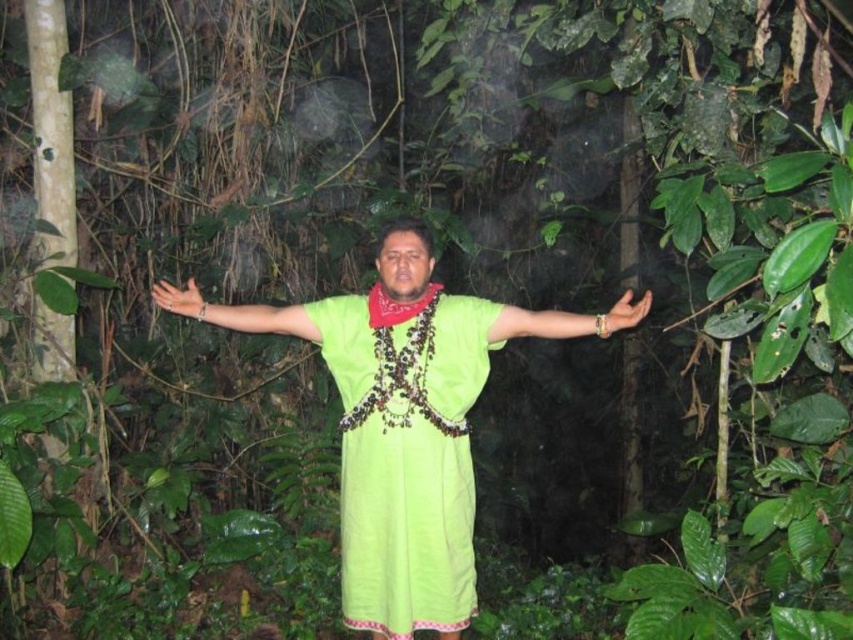
Question: Is lime green fabric at center wider than lime green fabric dress at center?

Choices:
 (A) yes
 (B) no

Answer: (A)

Question: Among these points, which one is farthest from the camera?

Choices:
 (A) (630, 307)
 (B) (581, 330)
 (C) (328, 362)
 (D) (177, 298)

Answer: (D)

Question: Which point is closer to the camera?

Choices:
 (A) (630, 320)
 (B) (376, 593)

Answer: (A)

Question: Is lime green fabric at center closer to camera compared to matte green hand at center?

Choices:
 (A) yes
 (B) no

Answer: (A)

Question: Which of the following is the farthest from the observer?

Choices:
 (A) (231, 310)
 (B) (364, 397)
 (C) (554, 324)

Answer: (A)

Question: From the image, what is the correct spatial relationship of lime green fabric at center in relation to green fabric arm at center?

Choices:
 (A) below
 (B) above

Answer: (A)